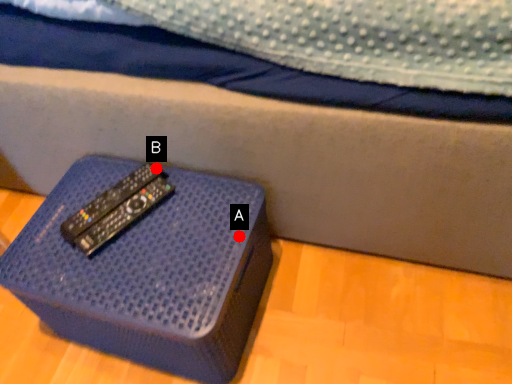
Question: Two points are circled on the image, labeled by A and B beside each circle. Among these points, which one is nearest to the camera?

Choices:
 (A) A is closer
 (B) B is closer

Answer: (A)